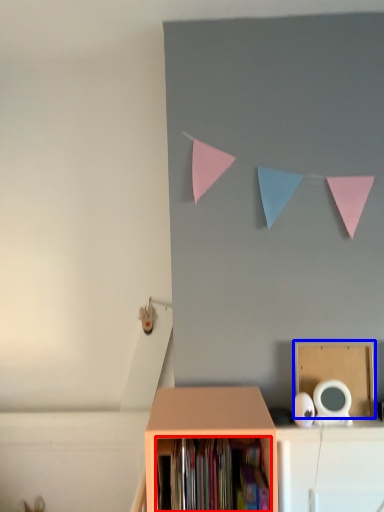
Question: Which point is further to the camera, book (highlighted by a red box) or cardboard box (highlighted by a blue box)?

Choices:
 (A) book
 (B) cardboard box

Answer: (B)